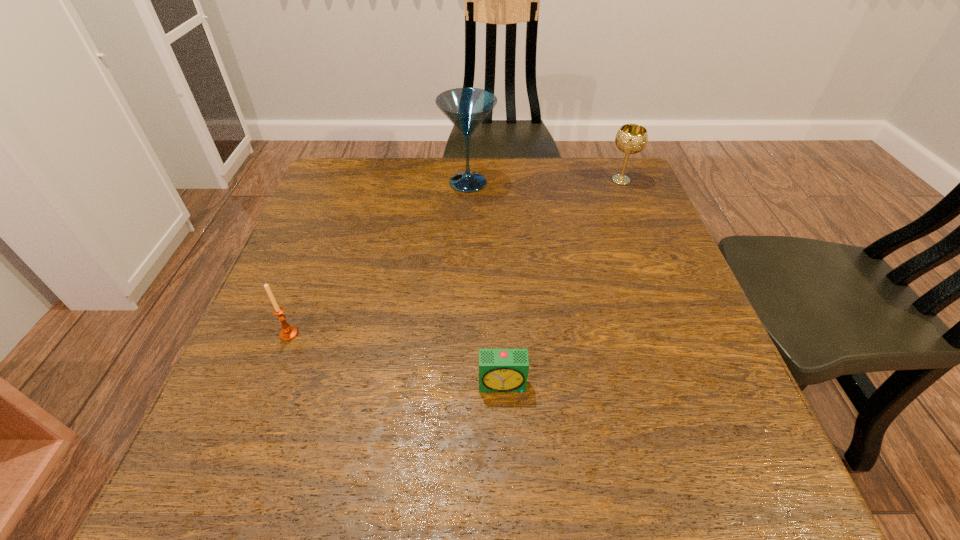
In order to click on the tallest object in this screenshot , I will do `click(466, 108)`.

Find the location of `the rightmost object`. the rightmost object is located at coordinates (631, 138).

At what (x,y) coordinates should I click in order to perform the action: click on the third farthest object. Please return your answer as a coordinate pair (x, y). The image size is (960, 540). Looking at the image, I should click on (288, 332).

Image resolution: width=960 pixels, height=540 pixels. Identify the location of the leftmost object. (288, 332).

Where is `the nearest object`? This screenshot has height=540, width=960. the nearest object is located at coordinates (500, 370).

At what (x,y) coordinates should I click in order to perform the action: click on the shortest object. Please return your answer as a coordinate pair (x, y). Image resolution: width=960 pixels, height=540 pixels. Looking at the image, I should click on (500, 370).

This screenshot has width=960, height=540. I want to click on vacant region located on the left of the tallest object, so click(x=420, y=183).

This screenshot has width=960, height=540. I want to click on vacant space located on the left of the rightmost object, so point(482,180).

What are the coordinates of `free space located 0.180m on the back of the third farthest object` in the screenshot? It's located at (316, 264).

Locate an element on the screen. The height and width of the screenshot is (540, 960). free space located 0.070m on the front-facing side of the shortest object is located at coordinates (505, 432).